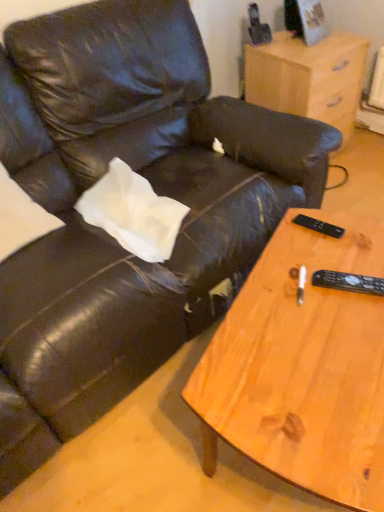
This screenshot has width=384, height=512. Identify the location of vacant point to the left of black plastic remote at right, which ranks as the 1th remote in top-to-bottom order. (282, 246).